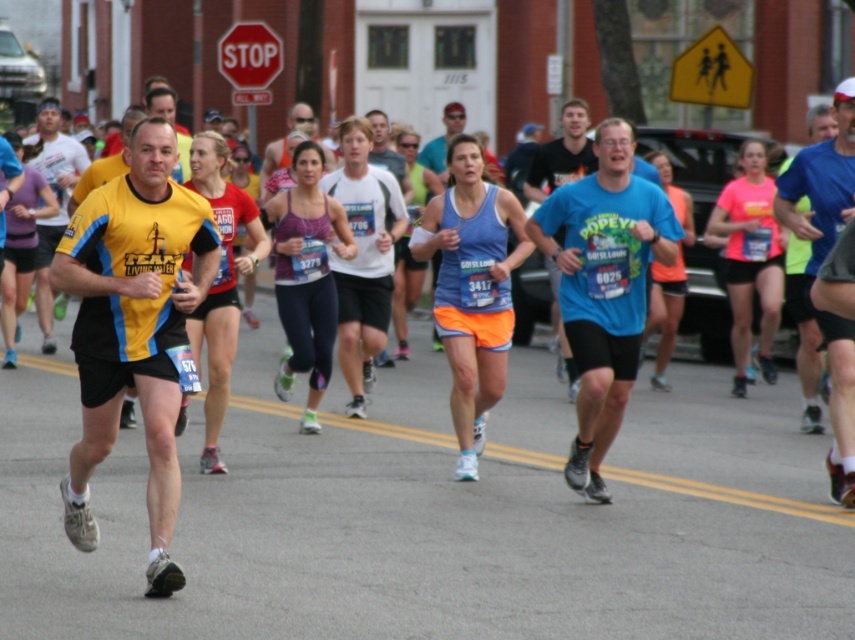
Who is more forward, (160, 148) or (86, 161)?

Point (160, 148) is more forward.

Who is positioned more to the right, yellow fabric shirt at center or yellow fabric shirt at left?

yellow fabric shirt at center

Is point (157, 122) in front of point (50, 115)?

Yes.

Where is `yellow fabric shirt at center`? yellow fabric shirt at center is located at coordinates (134, 326).

Can you confirm if yellow fabric shirt at center is positioned to the left of blue fabric shirt at right?

Correct, you'll find yellow fabric shirt at center to the left of blue fabric shirt at right.

The width and height of the screenshot is (855, 640). What do you see at coordinates (134, 326) in the screenshot?
I see `yellow fabric shirt at center` at bounding box center [134, 326].

You are a GUI agent. You are given a task and a screenshot of the screen. Output one action in this format:
    pyautogui.click(x=<x>, y=<y>)
    Task: Click on the yellow fabric shirt at center
    
    Given the screenshot: What is the action you would take?
    pyautogui.click(x=134, y=326)

Which of these two, matte blue tank top at center or yellow fabric shirt at left, stands taller?

yellow fabric shirt at left is taller.

Is matte blue tank top at center above yellow fabric shirt at left?

Actually, matte blue tank top at center is below yellow fabric shirt at left.

Who is more forward, [470,301] or [57,140]?

Point [470,301] is more forward.

The width and height of the screenshot is (855, 640). What are the coordinates of `matte blue tank top at center` in the screenshot? It's located at (472, 289).